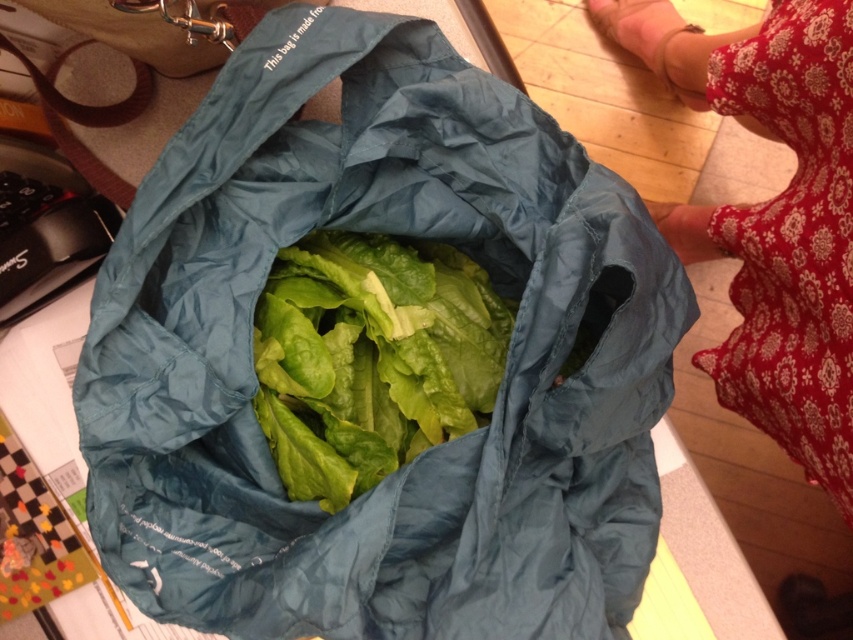
Question: Is teal fabric bag at center to the right of green leafy lettuce at center from the viewer's perspective?

Choices:
 (A) no
 (B) yes

Answer: (B)

Question: Which point appears closest to the camera in this image?

Choices:
 (A) (440, 413)
 (B) (814, 237)

Answer: (A)

Question: Among these points, which one is farthest from the camera?

Choices:
 (A) (325, 355)
 (B) (643, 24)

Answer: (B)

Question: Among these objects, which one is nearest to the camera?

Choices:
 (A) teal fabric bag at center
 (B) green leafy lettuce at center

Answer: (A)

Question: Is teal fabric bag at center above red floral dress at lower right?

Choices:
 (A) yes
 (B) no

Answer: (B)

Question: Is teal fabric bag at center further to the viewer compared to red floral dress at lower right?

Choices:
 (A) no
 (B) yes

Answer: (A)